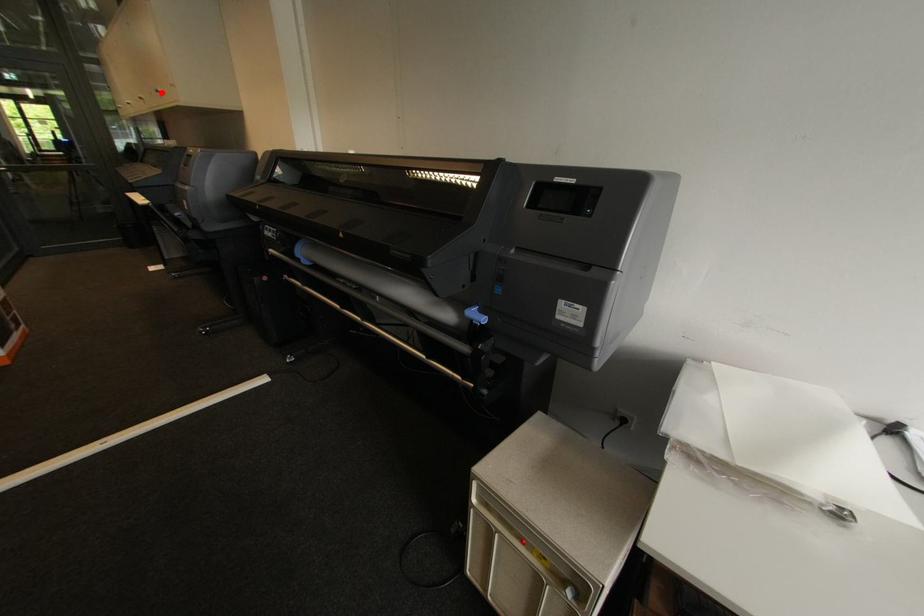
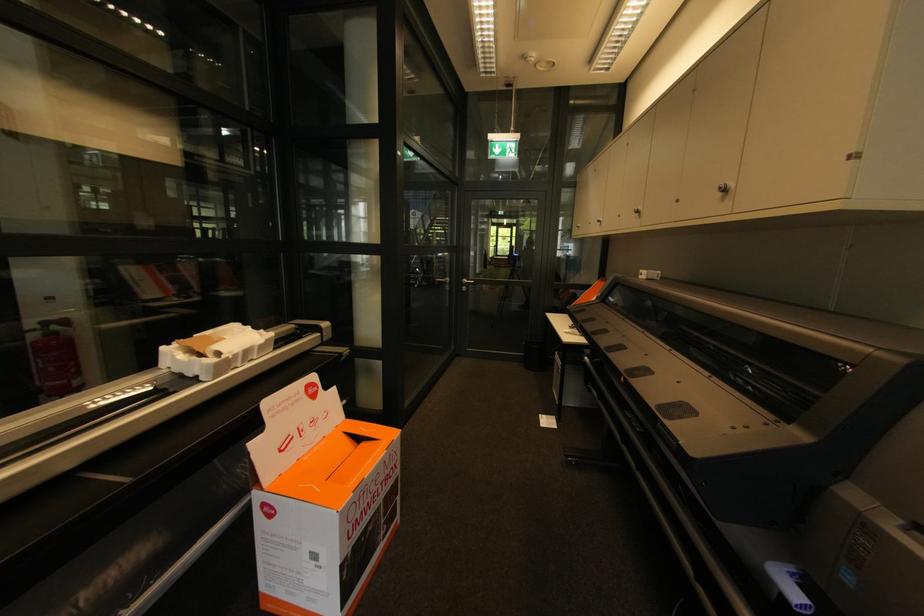
Question: A red point is marked in image1. In image2, is the corresponding 3D point closer to the camera or farther? Reply with the corresponding letter.

Choices:
 (A) The corresponding 3D point is closer.
 (B) The corresponding 3D point is farther.

Answer: (A)